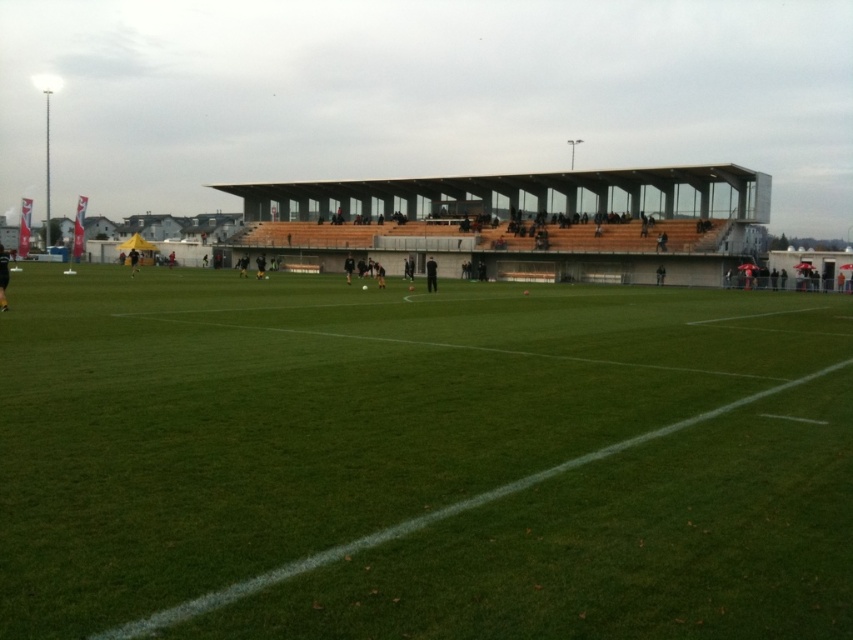
Question: Which object is closer to the camera taking this photo?

Choices:
 (A) transparent glass stadium at upper center
 (B) green grass field at center

Answer: (B)

Question: Among these points, which one is farthest from the camera?

Choices:
 (A) (676, 486)
 (B) (544, 230)

Answer: (B)

Question: Considering the relative positions of green grass field at center and transparent glass stadium at upper center in the image provided, where is green grass field at center located with respect to transparent glass stadium at upper center?

Choices:
 (A) above
 (B) below

Answer: (B)

Question: Does green grass field at center have a smaller size compared to transparent glass stadium at upper center?

Choices:
 (A) no
 (B) yes

Answer: (B)

Question: Is green grass field at center below transparent glass stadium at upper center?

Choices:
 (A) yes
 (B) no

Answer: (A)